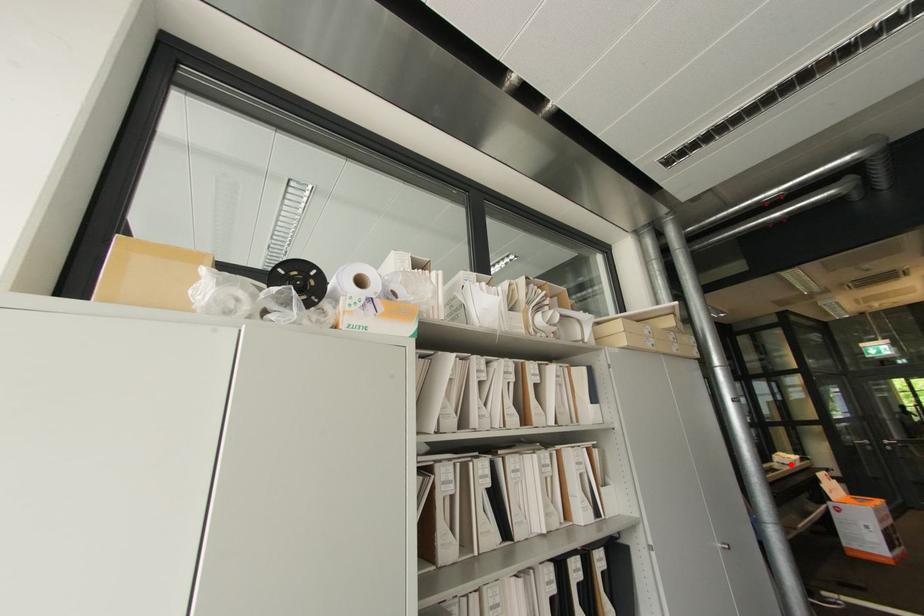
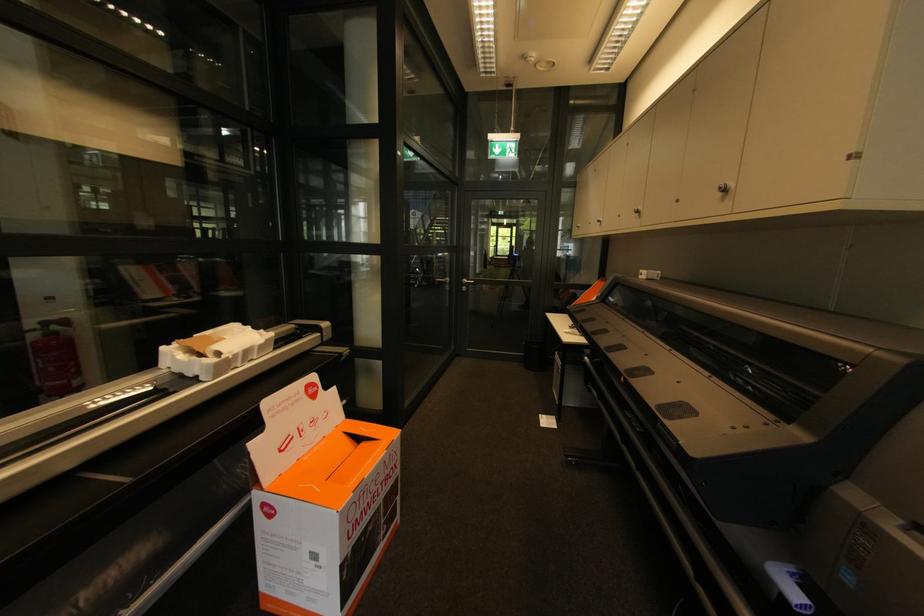
Question: I am providing you with two images of the same scene from different viewpoints. In image1, a red point is highlighted. Considering the same 3D point in image2, which of the following is correct?

Choices:
 (A) It is closer
 (B) It is farther

Answer: (B)